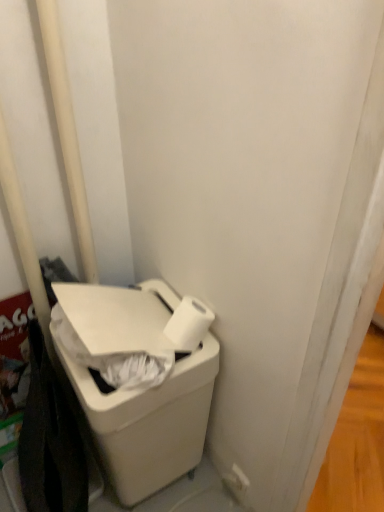
Question: Is white matte toilet paper at lower right not near white plastic pole at left?

Choices:
 (A) no
 (B) yes

Answer: (A)

Question: Does white matte toilet paper at lower right have a lesser height compared to white plastic pole at left?

Choices:
 (A) no
 (B) yes

Answer: (B)

Question: From the image's perspective, is white matte toilet paper at lower right on white plastic pole at left?

Choices:
 (A) yes
 (B) no

Answer: (B)

Question: From a real-world perspective, is white matte toilet paper at lower right on white plastic pole at left?

Choices:
 (A) no
 (B) yes

Answer: (A)

Question: Is white matte toilet paper at lower right taller than white plastic pole at left?

Choices:
 (A) no
 (B) yes

Answer: (A)

Question: Is white plastic waste container at lower left wider or thinner than white matte toilet paper at lower right?

Choices:
 (A) thin
 (B) wide

Answer: (B)

Question: Considering the positions of point (180, 372) and point (196, 339), is point (180, 372) closer or farther from the camera than point (196, 339)?

Choices:
 (A) farther
 (B) closer

Answer: (B)

Question: From a real-world perspective, is white plastic waste container at lower left positioned above or below white matte toilet paper at lower right?

Choices:
 (A) below
 (B) above

Answer: (A)

Question: Would you say white plastic waste container at lower left is inside or outside white matte toilet paper at lower right?

Choices:
 (A) outside
 (B) inside

Answer: (A)

Question: Is white plastic pole at left bigger or smaller than white plastic waste container at lower left?

Choices:
 (A) small
 (B) big

Answer: (A)

Question: In the image, is white plastic pole at left positioned in front of or behind white plastic waste container at lower left?

Choices:
 (A) behind
 (B) front

Answer: (A)

Question: Is point (56, 24) closer or farther from the camera than point (137, 394)?

Choices:
 (A) farther
 (B) closer

Answer: (B)

Question: Considering the positions of white plastic pole at left and white plastic waste container at lower left in the image, is white plastic pole at left wider or thinner than white plastic waste container at lower left?

Choices:
 (A) wide
 (B) thin

Answer: (B)

Question: In terms of size, does white matte toilet paper at lower right appear bigger or smaller than white plastic pole at left?

Choices:
 (A) big
 (B) small

Answer: (B)

Question: Relative to white plastic pole at left, is white matte toilet paper at lower right in front or behind?

Choices:
 (A) behind
 (B) front

Answer: (A)